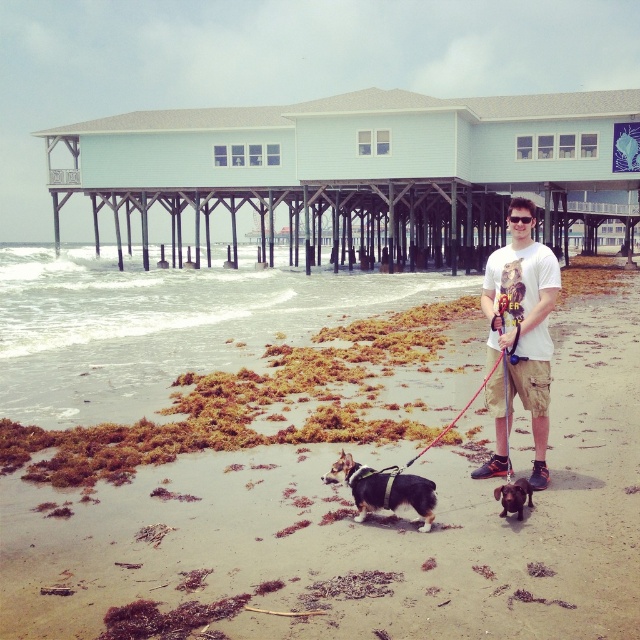
You are a drone operator tasked with capturing aerial footage of the light blue wooden pier at upper center. Your drone has a maximum flight range of 40 meters. Based on the scene, can your drone reach the pier?

The light blue wooden pier at upper center and viewer are 41.59 meters apart from each other. Since the drone can only fly up to 40 meters, it cannot reach the pier.